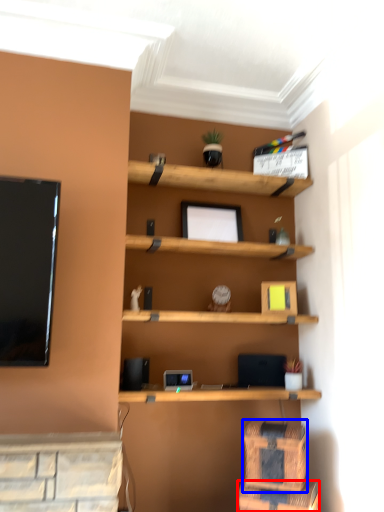
Question: Which point is further to the camera, drawer (highlighted by a red box) or drawer (highlighted by a blue box)?

Choices:
 (A) drawer
 (B) drawer

Answer: (B)